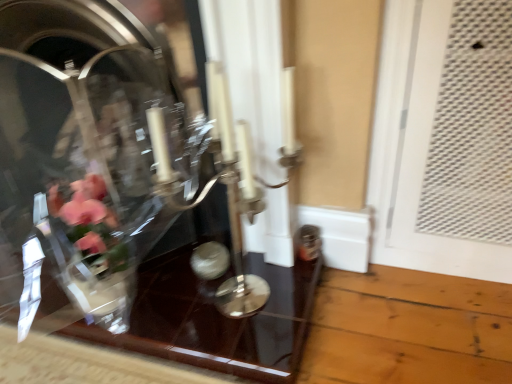
Locate an element on the screen. vacant area in front of silver metallic candle holder at center is located at coordinates (258, 341).